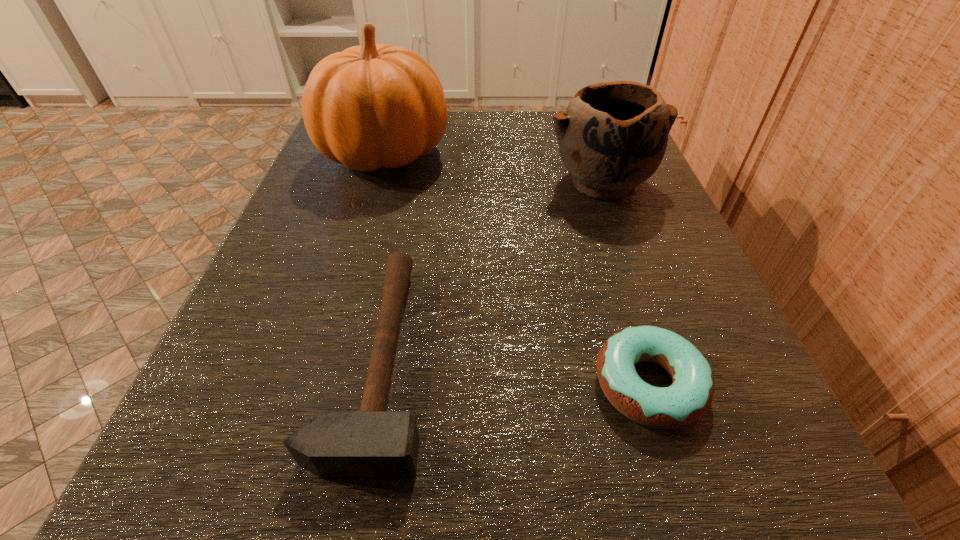
What are the coordinates of `vacant space that's between the shortest object and the tallest object` in the screenshot? It's located at (517, 269).

You are a GUI agent. You are given a task and a screenshot of the screen. Output one action in this format:
    pyautogui.click(x=<x>, y=<y>)
    Task: Click on the free area in between the doughnut and the second tallest object
    
    Given the screenshot: What is the action you would take?
    pyautogui.click(x=625, y=284)

Find the location of a particular element. free space between the tallest object and the shortest object is located at coordinates (517, 269).

You are a GUI agent. You are given a task and a screenshot of the screen. Output one action in this format:
    pyautogui.click(x=<x>, y=<y>)
    Task: Click on the object that is the third closest to the hammer
    The height and width of the screenshot is (540, 960).
    Given the screenshot: What is the action you would take?
    pyautogui.click(x=612, y=137)

I want to click on object that is the closest to the hammer, so click(x=689, y=397).

This screenshot has height=540, width=960. Identify the location of free space that satisfies the following two spatial constraints: 1. on the striking surface of the third tallest object; 2. on the back side of the shortest object. (373, 384).

Where is `vacant point that satisfies the following two spatial constraints: 1. on the striking surface of the shortest object; 2. on the left side of the hammer`? vacant point that satisfies the following two spatial constraints: 1. on the striking surface of the shortest object; 2. on the left side of the hammer is located at coordinates (373, 384).

At what (x,y) coordinates should I click in order to perform the action: click on vacant space that satisfies the following two spatial constraints: 1. on the striking surface of the doughnut; 2. on the right side of the third tallest object. Please return your answer as a coordinate pair (x, y). Looking at the image, I should click on (x=373, y=384).

Identify the location of vacant space that satisfies the following two spatial constraints: 1. on the striking surface of the doughnut; 2. on the right side of the third tallest object. Image resolution: width=960 pixels, height=540 pixels. (373, 384).